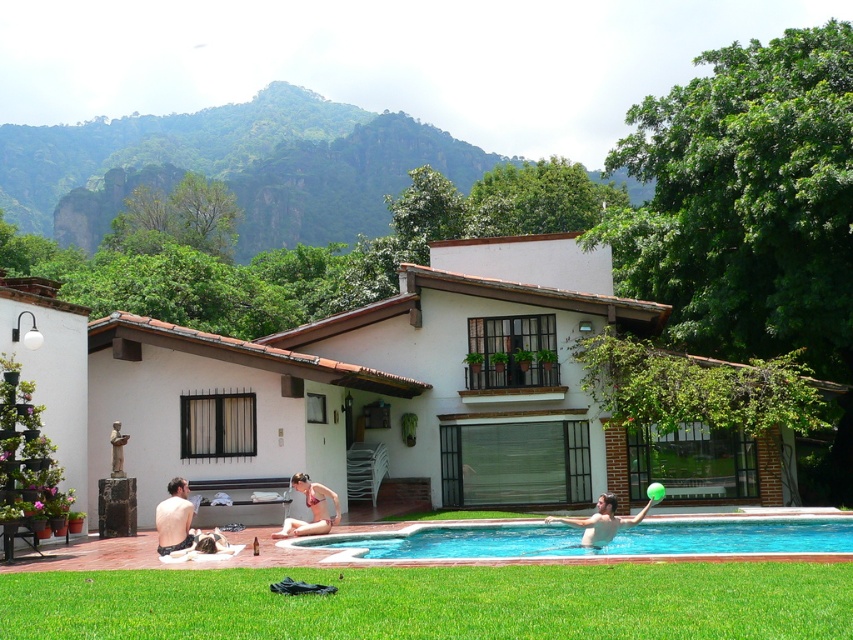
You are a photographer planning to take a photo of the green grass at lower center and the shiny black swimwear at lower left. Which object should you focus on first if you want both to be in sharp focus?

The green grass at lower center is much taller than the shiny black swimwear at lower left, so focusing on the closer object, the shiny black swimwear at lower left, will ensure both are in focus due to the depth of field.

You are standing at the edge of the pool and see the blue glossy water at lower center and the smooth green ball at lower center. Which object is closer to you?

The blue glossy water at lower center is closer to you because it is in front of the smooth green ball at lower center.

You are taking a photo of the pool area and want to focus on both the point at coordinates point [740,566] and point [206,547]. Which point should you adjust your focus to first if you want to ensure the closer one is in sharp focus?

Point [740,566] is closer to the camera than point [206,547], so you should focus on point [740,566] first to ensure it is in sharp focus.